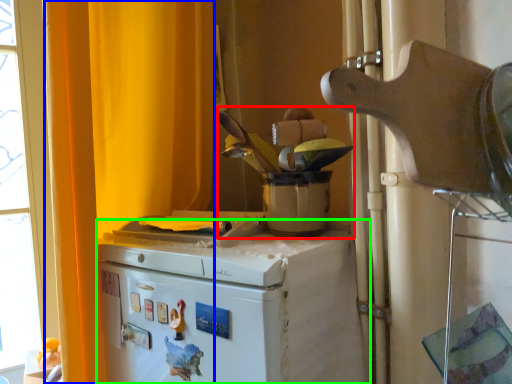
Question: Considering the real-world distances, which object is farthest from appliance (highlighted by a red box)? curtain (highlighted by a blue box) or home appliance (highlighted by a green box)?

Choices:
 (A) curtain
 (B) home appliance

Answer: (A)